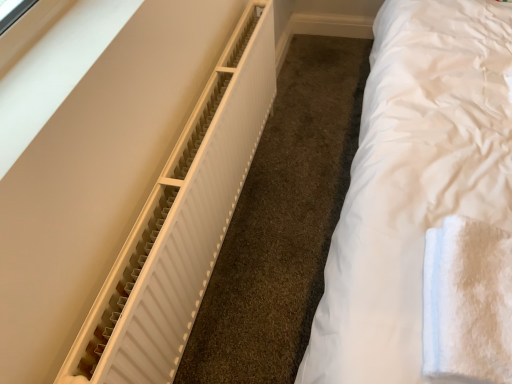
Question: Is white fluffy towel at right bigger than white matte radiator at left?

Choices:
 (A) no
 (B) yes

Answer: (A)

Question: From the image's perspective, is white fluffy towel at right above white matte radiator at left?

Choices:
 (A) yes
 (B) no

Answer: (B)

Question: Is white fluffy towel at right to the left of white matte radiator at left from the viewer's perspective?

Choices:
 (A) yes
 (B) no

Answer: (B)

Question: Can you confirm if white fluffy towel at right is taller than white matte radiator at left?

Choices:
 (A) yes
 (B) no

Answer: (B)

Question: Considering the relative sizes of white fluffy towel at right and white matte radiator at left in the image provided, is white fluffy towel at right wider than white matte radiator at left?

Choices:
 (A) yes
 (B) no

Answer: (A)

Question: Is white fluffy towel at right further to camera compared to white matte radiator at left?

Choices:
 (A) no
 (B) yes

Answer: (A)

Question: Does white matte radiator at left lie in front of white fluffy towel at right?

Choices:
 (A) yes
 (B) no

Answer: (B)

Question: From the image's perspective, would you say white matte radiator at left is shown under white fluffy towel at right?

Choices:
 (A) no
 (B) yes

Answer: (A)

Question: Is white matte radiator at left aimed at white fluffy towel at right?

Choices:
 (A) no
 (B) yes

Answer: (B)

Question: Is white matte radiator at left behind white fluffy towel at right?

Choices:
 (A) yes
 (B) no

Answer: (A)

Question: Is white matte radiator at left turned away from white fluffy towel at right?

Choices:
 (A) no
 (B) yes

Answer: (A)

Question: From a real-world perspective, is white matte radiator at left under white fluffy towel at right?

Choices:
 (A) no
 (B) yes

Answer: (B)

Question: Relative to white fluffy towel at right, is white matte radiator at left in front or behind?

Choices:
 (A) front
 (B) behind

Answer: (B)